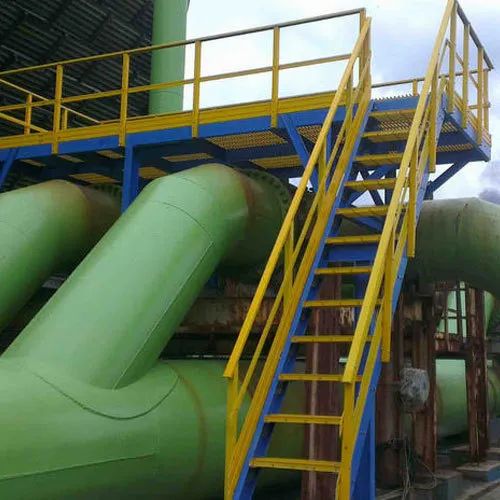
The image size is (500, 500). What are the coordinates of `4th stair` in the screenshot? It's located at (342, 336).